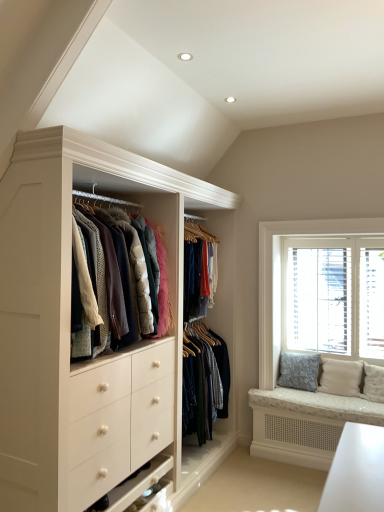
Question: From the image's perspective, is white wooden window at right under textured beige pillow at right, positioned as the 1th pillow in right-to-left order?

Choices:
 (A) yes
 (B) no

Answer: (B)

Question: Is the position of white wooden window at right less distant than that of textured beige pillow at right, positioned as the 1th pillow in right-to-left order?

Choices:
 (A) no
 (B) yes

Answer: (A)

Question: Does white wooden window at right have a lesser width compared to textured beige pillow at right, positioned as the 1th pillow in right-to-left order?

Choices:
 (A) yes
 (B) no

Answer: (A)

Question: Is textured beige pillow at right, which is counted as the second pillow, starting from the left, inside white wooden window at right?

Choices:
 (A) yes
 (B) no

Answer: (B)

Question: Can you confirm if white wooden window at right is taller than textured beige pillow at right, which is counted as the second pillow, starting from the left?

Choices:
 (A) no
 (B) yes

Answer: (B)

Question: From a real-world perspective, is blue floral cushion at right, which is the 1th pillow from left to right, physically located above or below white wooden window at right?

Choices:
 (A) below
 (B) above

Answer: (A)

Question: Does point (279, 373) appear closer or farther from the camera than point (382, 232)?

Choices:
 (A) farther
 (B) closer

Answer: (A)

Question: In terms of width, does blue floral cushion at right, acting as the 2th pillow starting from the right, look wider or thinner when compared to white wooden window at right?

Choices:
 (A) thin
 (B) wide

Answer: (B)

Question: Based on their sizes in the image, would you say blue floral cushion at right, acting as the 2th pillow starting from the right, is bigger or smaller than white wooden window at right?

Choices:
 (A) small
 (B) big

Answer: (A)

Question: Relative to textured beige pillow at right, which is counted as the second pillow, starting from the left, is blue floral cushion at right, acting as the 2th pillow starting from the right, in front or behind?

Choices:
 (A) front
 (B) behind

Answer: (B)

Question: Based on their positions, is blue floral cushion at right, acting as the 2th pillow starting from the right, located to the left or right of textured beige pillow at right, positioned as the 1th pillow in right-to-left order?

Choices:
 (A) right
 (B) left

Answer: (B)

Question: Do you think blue floral cushion at right, acting as the 2th pillow starting from the right, is within textured beige pillow at right, positioned as the 1th pillow in right-to-left order, or outside of it?

Choices:
 (A) outside
 (B) inside

Answer: (A)

Question: Is point (291, 378) closer or farther from the camera than point (334, 378)?

Choices:
 (A) closer
 (B) farther

Answer: (B)

Question: From the image's perspective, relative to white wooden window at right, is textured beige pillow at right, which is counted as the second pillow, starting from the left, above or below?

Choices:
 (A) below
 (B) above

Answer: (A)

Question: Looking at the image, does textured beige pillow at right, positioned as the 1th pillow in right-to-left order, seem bigger or smaller compared to white wooden window at right?

Choices:
 (A) big
 (B) small

Answer: (B)